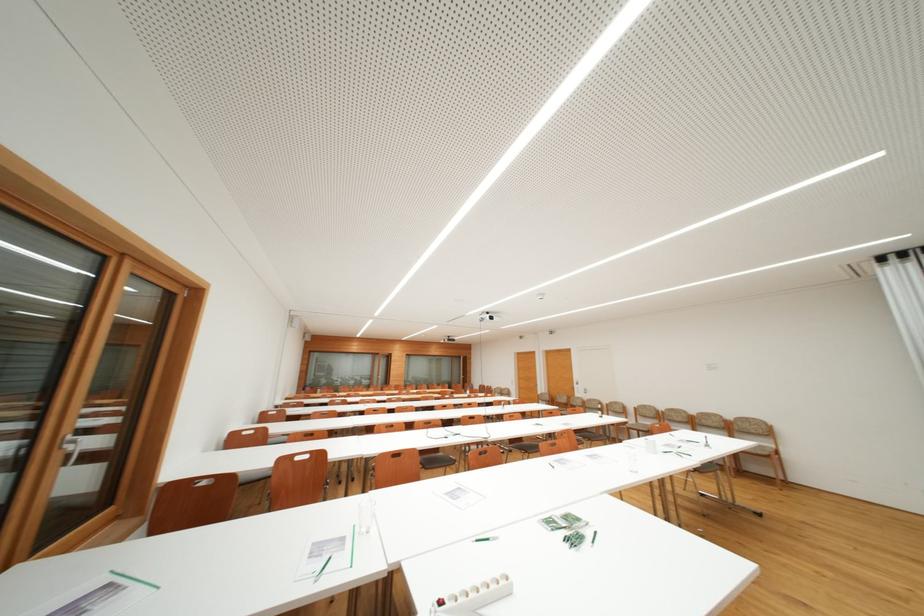
Image resolution: width=924 pixels, height=616 pixels. I want to click on wooden chair sitting surface, so click(436, 460).